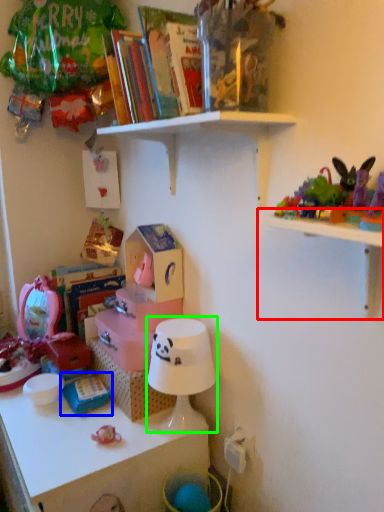
Question: Considering the real-world distances, which object is closest to shelf (highlighted by a red box)? toy (highlighted by a blue box) or lamp (highlighted by a green box).

Choices:
 (A) toy
 (B) lamp

Answer: (B)